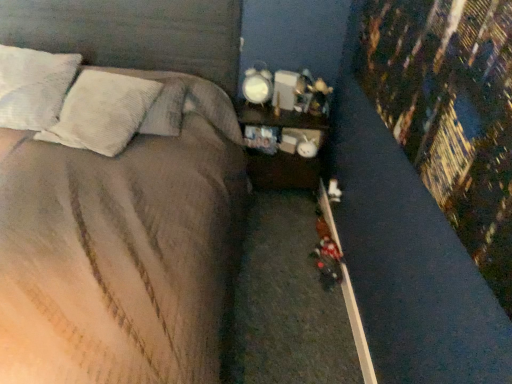
Question: Is white textured pillow at upper left, the second pillow in the right-to-left sequence, placed right next to satin brown bed at center?

Choices:
 (A) no
 (B) yes

Answer: (A)

Question: Is white textured pillow at upper left, which is counted as the second pillow, starting from the left, positioned with its back to satin brown bed at center?

Choices:
 (A) no
 (B) yes

Answer: (B)

Question: Does white textured pillow at upper left, which is counted as the second pillow, starting from the left, have a greater width compared to satin brown bed at center?

Choices:
 (A) no
 (B) yes

Answer: (A)

Question: From a real-world perspective, is white textured pillow at upper left, which is counted as the second pillow, starting from the left, located beneath satin brown bed at center?

Choices:
 (A) yes
 (B) no

Answer: (B)

Question: Is there a large distance between white textured pillow at upper left, which is counted as the second pillow, starting from the left, and satin brown bed at center?

Choices:
 (A) yes
 (B) no

Answer: (B)

Question: Looking at the image, does satin brown bed at center seem bigger or smaller compared to wooden nightstand at center?

Choices:
 (A) small
 (B) big

Answer: (B)

Question: Does point (177, 223) appear closer or farther from the camera than point (248, 160)?

Choices:
 (A) closer
 (B) farther

Answer: (A)

Question: Considering the positions of satin brown bed at center and wooden nightstand at center in the image, is satin brown bed at center wider or thinner than wooden nightstand at center?

Choices:
 (A) thin
 (B) wide

Answer: (B)

Question: Considering their positions, is satin brown bed at center located in front of or behind wooden nightstand at center?

Choices:
 (A) behind
 (B) front

Answer: (B)

Question: Is point (179, 112) closer or farther from the camera than point (271, 119)?

Choices:
 (A) closer
 (B) farther

Answer: (A)

Question: Considering the positions of white textured pillow at upper left, which ranks as the first pillow in right-to-left order, and wooden nightstand at center in the image, is white textured pillow at upper left, which ranks as the first pillow in right-to-left order, taller or shorter than wooden nightstand at center?

Choices:
 (A) short
 (B) tall

Answer: (A)

Question: From the image's perspective, is white textured pillow at upper left, which ranks as the first pillow in right-to-left order, positioned above or below wooden nightstand at center?

Choices:
 (A) below
 (B) above

Answer: (B)

Question: From a real-world perspective, is white textured pillow at upper left, which ranks as the first pillow in right-to-left order, physically located above or below wooden nightstand at center?

Choices:
 (A) above
 (B) below

Answer: (A)

Question: From the image's perspective, is wooden nightstand at center above or below white textured pillow at upper left, which is counted as the second pillow, starting from the left?

Choices:
 (A) above
 (B) below

Answer: (B)

Question: Would you say wooden nightstand at center is to the left or to the right of white textured pillow at upper left, which is counted as the second pillow, starting from the left, in the picture?

Choices:
 (A) right
 (B) left

Answer: (A)